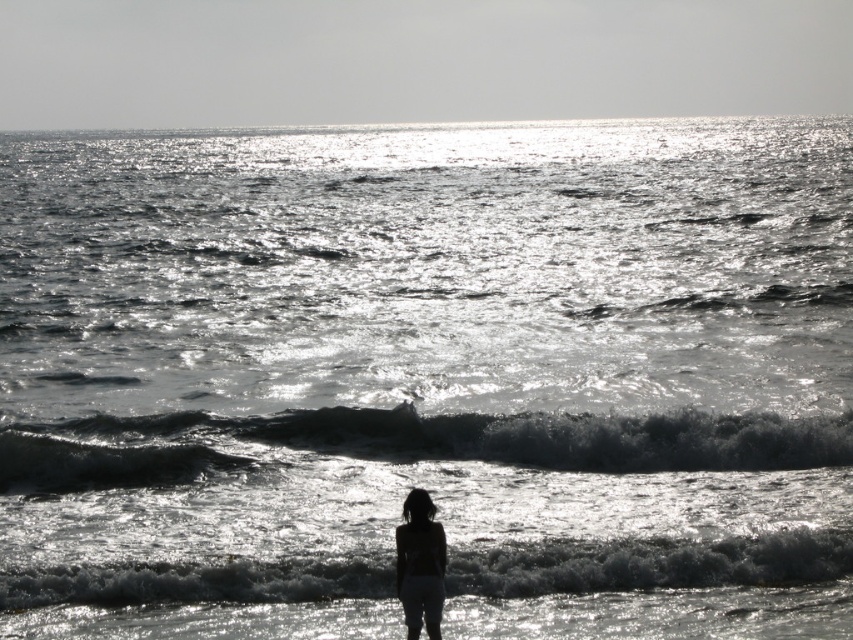
Is point (112, 465) farther from viewer compared to point (428, 593)?

That is True.

Is shiny dark water at lower center wider than silhouette fabric at center?

Indeed, shiny dark water at lower center has a greater width compared to silhouette fabric at center.

Which is in front, point (343, 426) or point (407, 602)?

Point (407, 602) is in front.

Find the location of a particular element. The height and width of the screenshot is (640, 853). shiny dark water at lower center is located at coordinates (410, 444).

Which is more to the left, shiny dark water at lower center or white frothy wave at lower center?

Positioned to the left is white frothy wave at lower center.

Is point (212, 451) farther from viewer compared to point (669, 557)?

Yes, point (212, 451) is farther from viewer.

Locate an element on the screen. shiny dark water at lower center is located at coordinates (410, 444).

Between white frothy wave at lower center and silhouette fabric at center, which one is positioned higher?

silhouette fabric at center

The image size is (853, 640). In order to click on white frothy wave at lower center in this screenshot , I will do `click(651, 563)`.